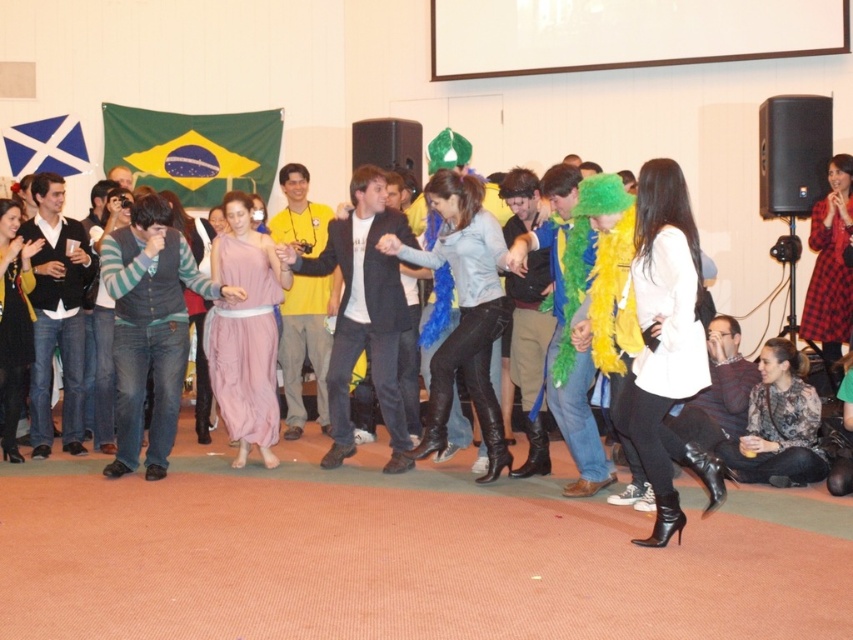
Is striped sweater at center shorter than matte black dress at center?

In fact, striped sweater at center may be taller than matte black dress at center.

Is striped sweater at center bigger than matte black dress at center?

Indeed, striped sweater at center has a larger size compared to matte black dress at center.

This screenshot has width=853, height=640. What do you see at coordinates (149, 326) in the screenshot? I see `striped sweater at center` at bounding box center [149, 326].

The height and width of the screenshot is (640, 853). I want to click on striped sweater at center, so click(x=149, y=326).

Does point (270, 154) come behind point (805, 330)?

Yes, point (270, 154) is farther from viewer.

Who is shorter, green fabric flag at upper center or plaid fabric dress at lower right?

Standing shorter between the two is green fabric flag at upper center.

Between point (171, 115) and point (827, 212), which one is positioned behind?

Positioned behind is point (171, 115).

Where is `green fabric flag at upper center`? This screenshot has width=853, height=640. green fabric flag at upper center is located at coordinates pos(193,150).

I want to click on floral print blouse at lower right, so click(778, 424).

Does point (785, 468) come closer to viewer compared to point (833, 342)?

Yes.

This screenshot has width=853, height=640. Identify the location of floral print blouse at lower right. (778, 424).